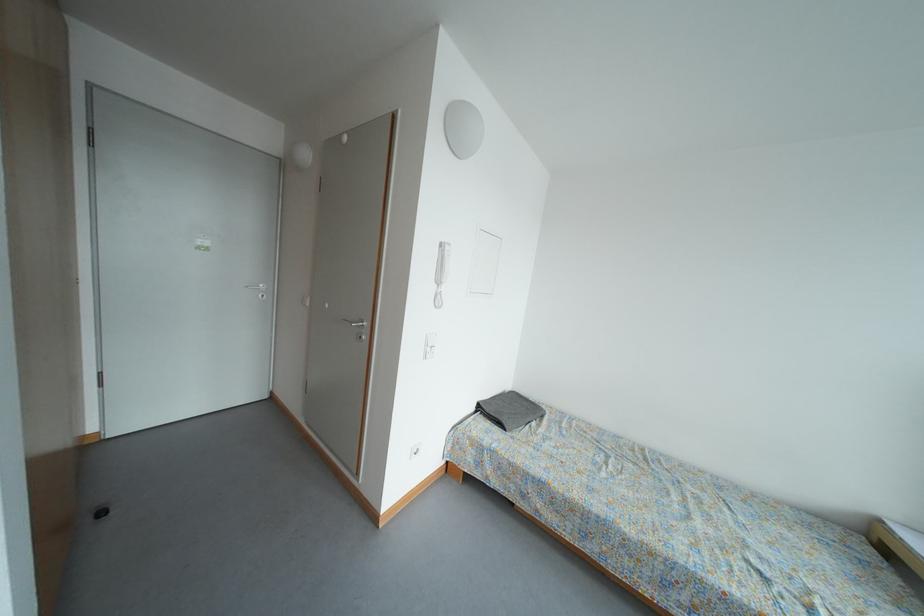
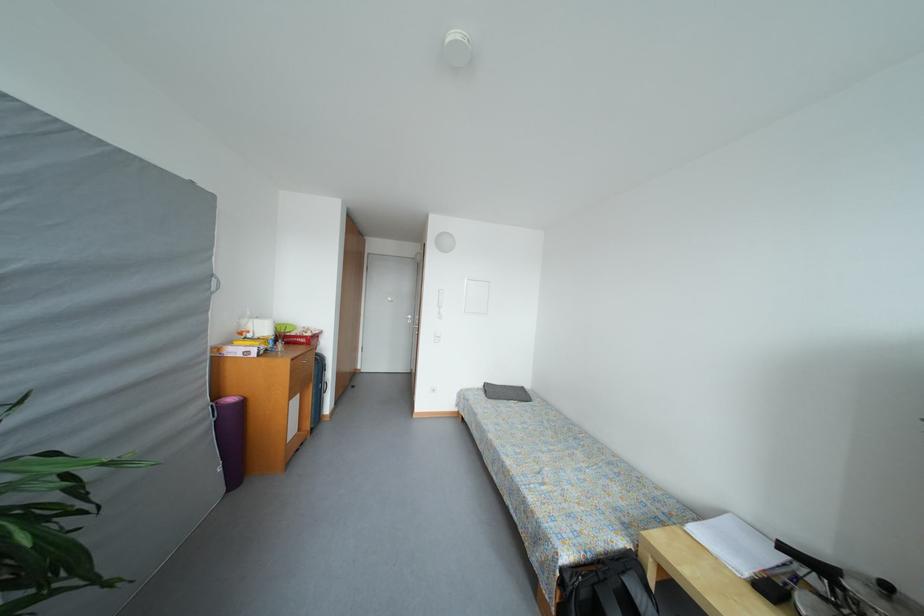
The point at (637, 536) is marked in the first image. Where is the corresponding point in the second image?

(496, 440)